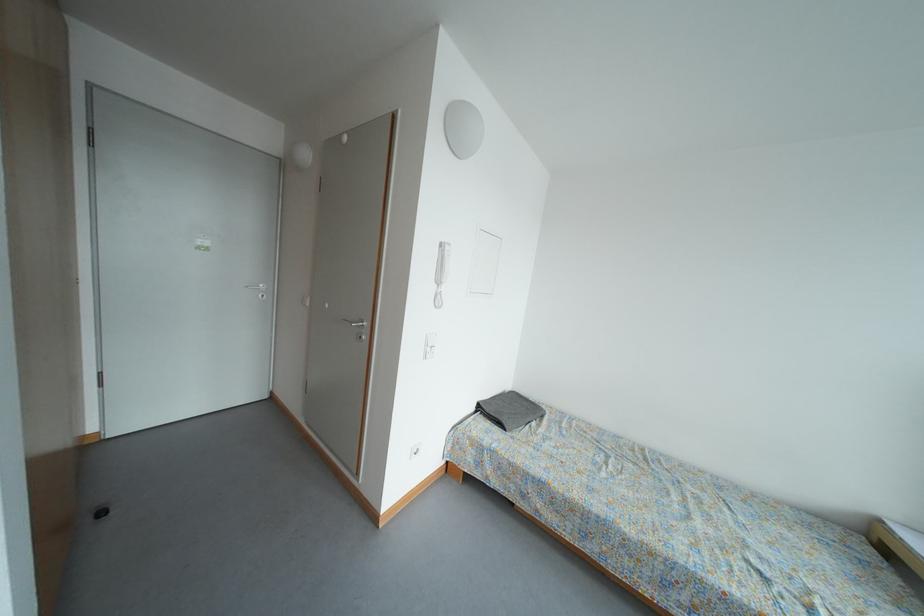
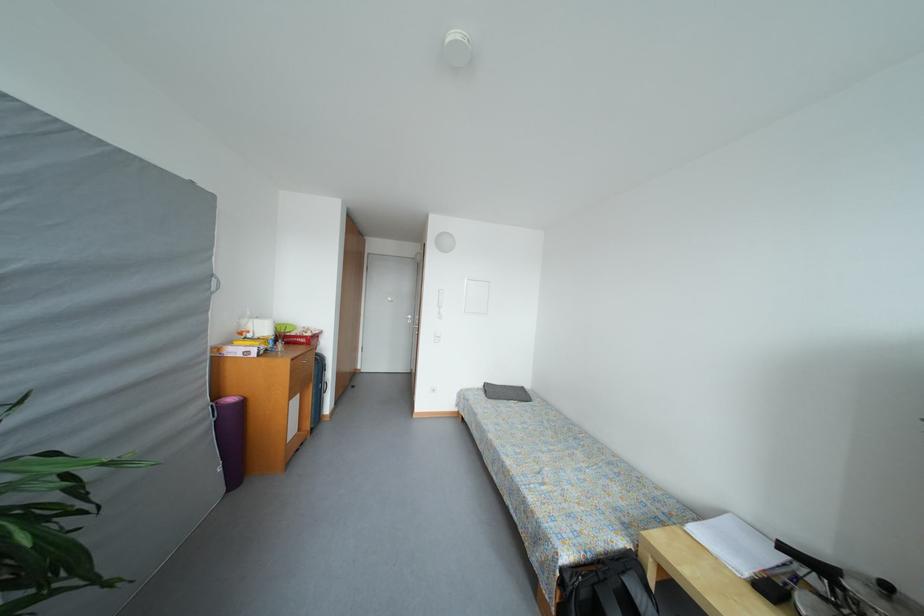
The point at (637, 536) is marked in the first image. Where is the corresponding point in the second image?

(496, 440)